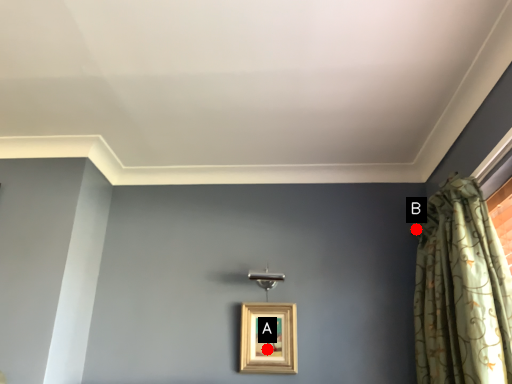
Question: Two points are circled on the image, labeled by A and B beside each circle. Which point is farther to the camera?

Choices:
 (A) A is further
 (B) B is further

Answer: (B)